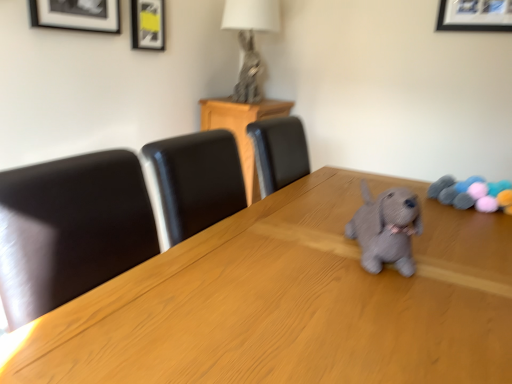
Identify the location of blank space situated above wooden table at center (from a real-world perspective). (355, 261).